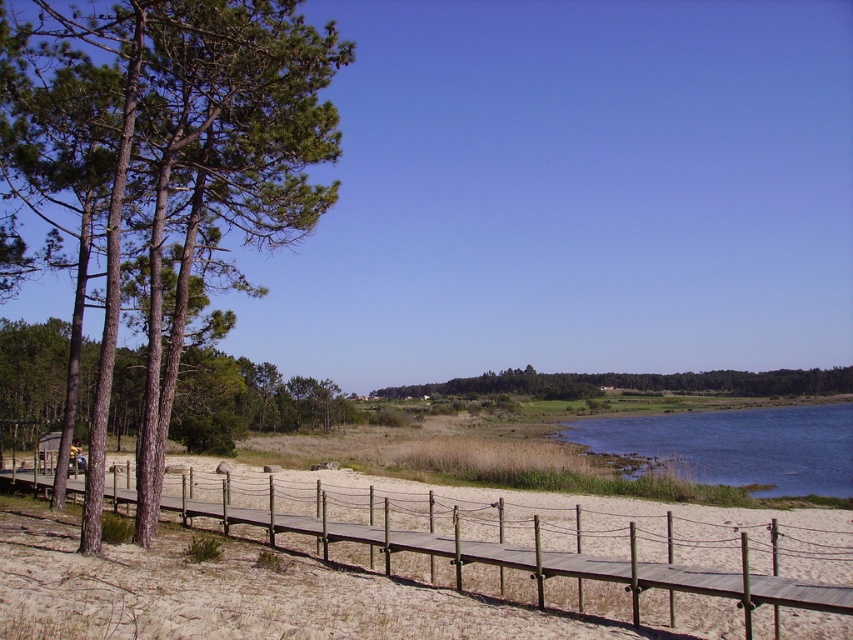
You are standing at the edge of the wooden boardwalk and notice the wooden fence at lower center and the brown rough tree at left. Which object takes up more area in the scene?

The brown rough tree at left occupies more space than the wooden fence at lower center according to the description.

You are standing at the point marked as point (189, 164) in the image. What object is located at that point?

The point (189, 164) corresponds to a brown rough tree at left.

You are standing on the wooden boardwalk and want to take a photo of the brown rough tree at left and the blue water at lower right. Which object will appear higher in the photo?

The brown rough tree at left appears higher in the photo because it is positioned above the blue water at lower right.